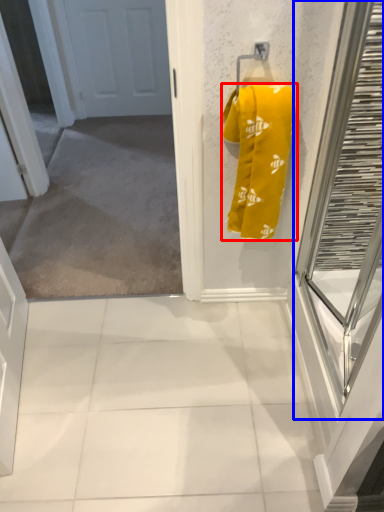
Question: Which of the following is the farthest to the observer, towel (highlighted by a red box) or glass door (highlighted by a blue box)?

Choices:
 (A) towel
 (B) glass door

Answer: (A)